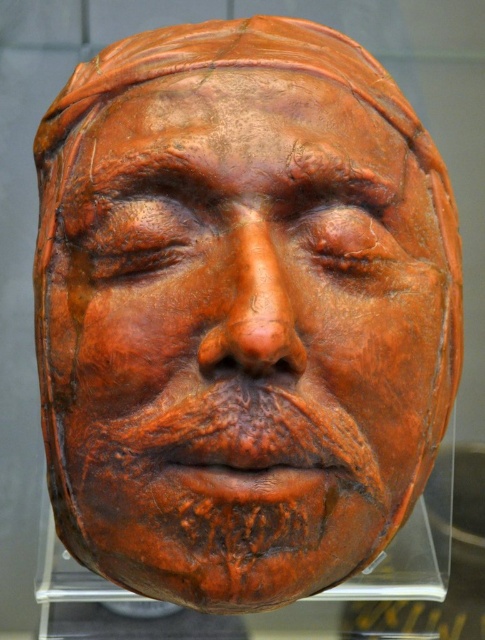
You are an art conservator examining two masks displayed in a case. You have a tool that can only reach items closer to you. Which mask, the matte clay mask at center or the transparent plastic mask at center, can you reach with your tool?

The matte clay mask at center is closer to the viewer than the transparent plastic mask at center, so you can reach the matte clay mask at center with your tool.

You are an art conservator examining the matte clay mask at center displayed in an acrylic case. To ensure proper preservation, you need to position a humidity sensor exactly at the center of the mask. According to the coordinates provided, is the sensor correctly placed at point 0.528, 0.499?

The matte clay mask at center is located at point (242, 337), so the sensor is correctly placed at the center of the mask as per the coordinates provided.

You are an art conservator examining the display case containing both the matte clay mask at center and the transparent plastic mask at center. Which of these two masks is positioned to the right within the case?

The matte clay mask at center is positioned to the right of the transparent plastic mask at center within the case.